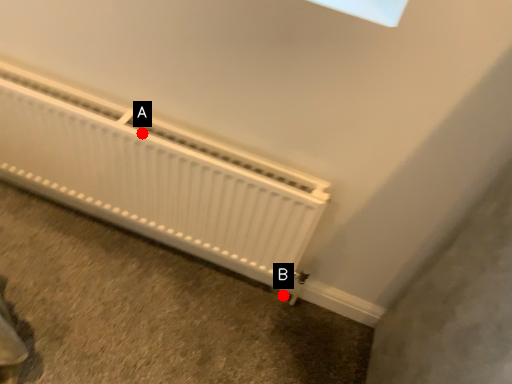
Question: Two points are circled on the image, labeled by A and B beside each circle. Which point is farther from the camera taking this photo?

Choices:
 (A) A is further
 (B) B is further

Answer: (B)